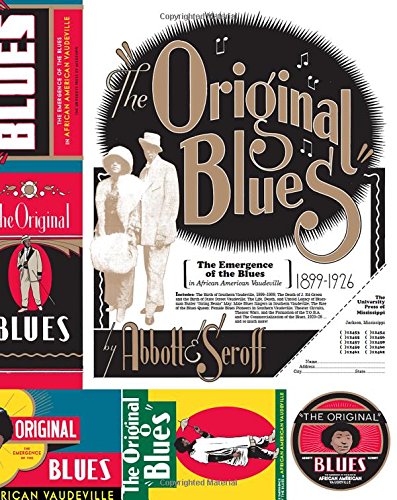
Identify the location of dish. This screenshot has width=397, height=500. (x=325, y=280).